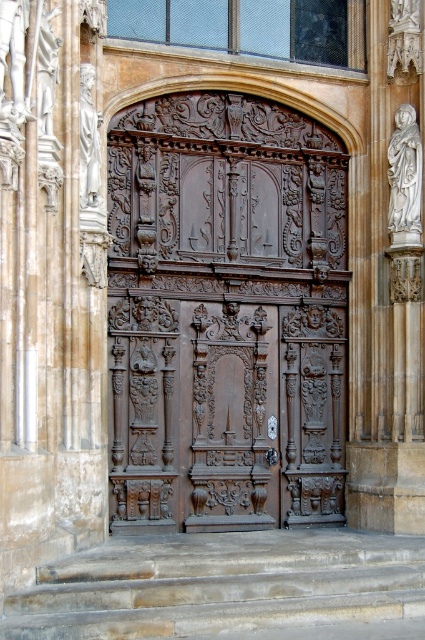
Is dark wood carved door at center behind white marble statue at right?

Yes.

Between dark wood carved door at center and white marble statue at right, which one appears on the left side from the viewer's perspective?

Positioned to the left is dark wood carved door at center.

Locate an element on the screen. The height and width of the screenshot is (640, 425). dark wood carved door at center is located at coordinates (226, 316).

Identify the location of dark wood carved door at center. This screenshot has height=640, width=425. (226, 316).

The image size is (425, 640). In order to click on dark wood carved door at center in this screenshot , I will do `click(226, 316)`.

Who is more forward, [130,307] or [79,140]?

Point [79,140] is more forward.

Where is `dark wood carved door at center`? This screenshot has width=425, height=640. dark wood carved door at center is located at coordinates (226, 316).

Is smooth stone stairs at lower center positioned at the back of white marble statue at right?

No, it is not.

This screenshot has width=425, height=640. Describe the element at coordinates (220, 584) in the screenshot. I see `smooth stone stairs at lower center` at that location.

This screenshot has height=640, width=425. Identify the location of smooth stone stairs at lower center. (220, 584).